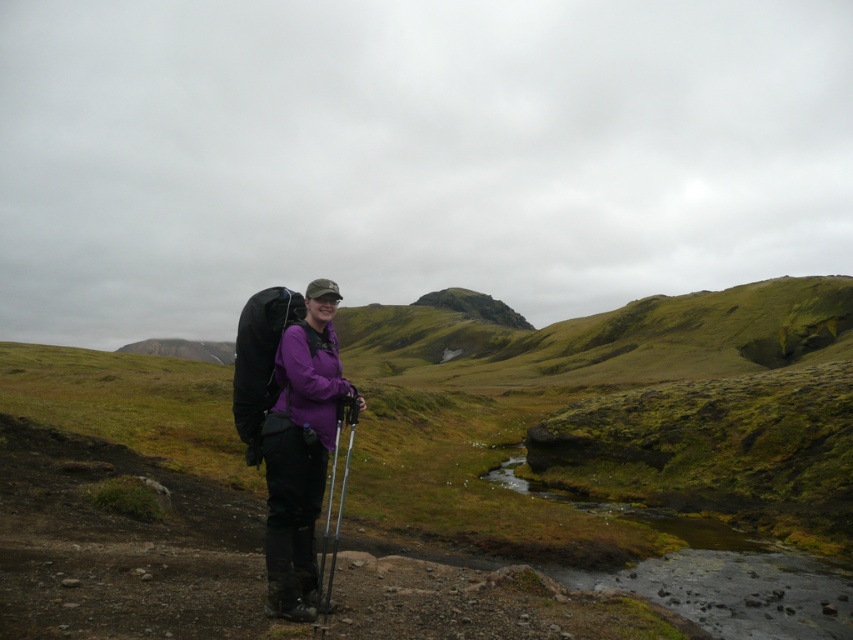
Question: Can you confirm if purple matte jacket at center is smaller than metallic silver ski pole at center?

Choices:
 (A) no
 (B) yes

Answer: (B)

Question: Which point appears closest to the camera in this image?

Choices:
 (A) (306, 554)
 (B) (357, 408)

Answer: (B)

Question: Is purple matte jacket at center to the left of metallic silver ski pole at center from the viewer's perspective?

Choices:
 (A) yes
 (B) no

Answer: (B)

Question: Which object appears closest to the camera in this image?

Choices:
 (A) purple matte jacket at center
 (B) metallic silver ski pole at center

Answer: (B)

Question: Which of the following is the farthest from the observer?

Choices:
 (A) purple matte jacket at center
 (B) metallic silver ski pole at center

Answer: (A)

Question: Is purple matte jacket at center closer to camera compared to metallic silver ski pole at center?

Choices:
 (A) yes
 (B) no

Answer: (B)